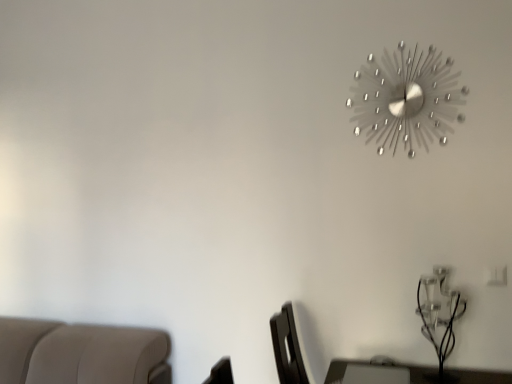
You are a GUI agent. You are given a task and a screenshot of the screen. Output one action in this format:
    pyautogui.click(x=<x>, y=<y>)
    Task: Click on the clear glass table lamp at lower right
    The image size is (512, 384).
    Given the screenshot: What is the action you would take?
    pyautogui.click(x=439, y=318)

Measure the distance between clear glass table lamp at lower right and camera.

clear glass table lamp at lower right and camera are 1.74 meters apart from each other.

From the picture: What is the approximate width of clear glass table lamp at lower right?

The width of clear glass table lamp at lower right is 9.66 inches.

What do you see at coordinates (439, 318) in the screenshot? I see `clear glass table lamp at lower right` at bounding box center [439, 318].

What do you see at coordinates (406, 99) in the screenshot? I see `metallic silver clock at upper right` at bounding box center [406, 99].

Measure the distance between point (379, 88) and camera.

Point (379, 88) is 6.15 feet away from camera.

Where is `metallic silver clock at upper right`? This screenshot has height=384, width=512. metallic silver clock at upper right is located at coordinates (406, 99).

Image resolution: width=512 pixels, height=384 pixels. I want to click on clear glass table lamp at lower right, so click(x=439, y=318).

Is clear glass table lamp at lower right to the left or to the right of metallic silver clock at upper right in the image?

clear glass table lamp at lower right is to the right of metallic silver clock at upper right.

In the scene shown: Relative to metallic silver clock at upper right, is clear glass table lamp at lower right in front or behind?

Clearly, clear glass table lamp at lower right is in front of metallic silver clock at upper right.

Does point (429, 298) lie in front of point (390, 73)?

That is True.

From the image's perspective, which is above, clear glass table lamp at lower right or metallic silver clock at upper right?

metallic silver clock at upper right.

Looking at this image, from a real-world perspective, is clear glass table lamp at lower right above or below metallic silver clock at upper right?

clear glass table lamp at lower right is below metallic silver clock at upper right.

Between clear glass table lamp at lower right and metallic silver clock at upper right, which one has smaller width?

metallic silver clock at upper right is thinner.

Is clear glass table lamp at lower right taller or shorter than metallic silver clock at upper right?

Clearly, clear glass table lamp at lower right is shorter compared to metallic silver clock at upper right.

Does clear glass table lamp at lower right have a larger size compared to metallic silver clock at upper right?

Yes.

From the picture: Is clear glass table lamp at lower right completely or partially outside of metallic silver clock at upper right?

That's correct, clear glass table lamp at lower right is outside of metallic silver clock at upper right.

Is clear glass table lamp at lower right far away from metallic silver clock at upper right?

clear glass table lamp at lower right is near metallic silver clock at upper right, not far away.

Is clear glass table lamp at lower right turned away from metallic silver clock at upper right?

clear glass table lamp at lower right does not have its back to metallic silver clock at upper right.

What's the angular difference between clear glass table lamp at lower right and metallic silver clock at upper right's facing directions?

0.718 degrees separate the facing orientations of clear glass table lamp at lower right and metallic silver clock at upper right.

Find the location of a particular element. The width and height of the screenshot is (512, 384). table lamp below the metallic silver clock at upper right (from the image's perspective) is located at coordinates (439, 318).

Considering the positions of objects metallic silver clock at upper right and clear glass table lamp at lower right in the image provided, who is more to the left, metallic silver clock at upper right or clear glass table lamp at lower right?

Positioned to the left is metallic silver clock at upper right.

Which object is closer to the camera, metallic silver clock at upper right or clear glass table lamp at lower right?

clear glass table lamp at lower right is in front.

Is point (439, 65) positioned after point (435, 321)?

Yes, point (439, 65) is farther from viewer.

From the image's perspective, between metallic silver clock at upper right and clear glass table lamp at lower right, which one is located above?

metallic silver clock at upper right, from the image's perspective.

In the scene shown: From a real-world perspective, is metallic silver clock at upper right below clear glass table lamp at lower right?

Incorrect, from a real-world perspective, metallic silver clock at upper right is higher than clear glass table lamp at lower right.

Considering the relative sizes of metallic silver clock at upper right and clear glass table lamp at lower right in the image provided, is metallic silver clock at upper right wider than clear glass table lamp at lower right?

No, metallic silver clock at upper right is not wider than clear glass table lamp at lower right.

Between metallic silver clock at upper right and clear glass table lamp at lower right, which one has more height?

metallic silver clock at upper right is taller.

Can you confirm if metallic silver clock at upper right is smaller than clear glass table lamp at lower right?

Yes, metallic silver clock at upper right is smaller than clear glass table lamp at lower right.

Do you think metallic silver clock at upper right is within clear glass table lamp at lower right, or outside of it?

The correct answer is: outside.

Is metallic silver clock at upper right far away from clear glass table lamp at lower right?

No.

Is metallic silver clock at upper right turned away from clear glass table lamp at lower right?

No.

How much distance is there between metallic silver clock at upper right and clear glass table lamp at lower right?

metallic silver clock at upper right and clear glass table lamp at lower right are 28.35 inches apart.

Where is `table lamp on the right of metallic silver clock at upper right`? The height and width of the screenshot is (384, 512). table lamp on the right of metallic silver clock at upper right is located at coordinates (439, 318).

This screenshot has width=512, height=384. In order to click on wall clock above the clear glass table lamp at lower right (from the image's perspective) in this screenshot , I will do `click(406, 99)`.

The width and height of the screenshot is (512, 384). Find the location of `wall clock located on the left of clear glass table lamp at lower right`. wall clock located on the left of clear glass table lamp at lower right is located at coordinates (406, 99).